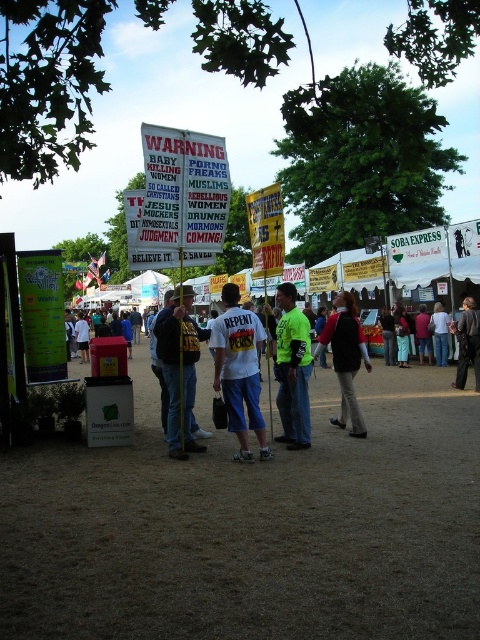
Who is more distant from viewer, (277, 426) or (440, 355)?

The point (440, 355) is behind.

Between point (324, 381) and point (442, 328), which one is positioned in front?

Positioned in front is point (324, 381).

Describe the element at coordinates (408, 394) in the screenshot. I see `white t-shirt at center` at that location.

The height and width of the screenshot is (640, 480). I want to click on white t-shirt at center, so click(408, 394).

Can you confirm if white matte shirt at center is positioned to the left of dark gray suit at center?

Yes, white matte shirt at center is to the left of dark gray suit at center.

What do you see at coordinates (239, 371) in the screenshot?
I see `white matte shirt at center` at bounding box center [239, 371].

The height and width of the screenshot is (640, 480). I want to click on white matte shirt at center, so click(x=239, y=371).

Which is below, brown dirt field at center or light blue jeans at center?

brown dirt field at center

Is point (120, 561) less distant than point (439, 356)?

Yes.

Locate an element on the screen. Image resolution: width=480 pixels, height=640 pixels. brown dirt field at center is located at coordinates (253, 525).

Locate an element on the screen. Image resolution: width=480 pixels, height=640 pixels. brown dirt field at center is located at coordinates (253, 525).